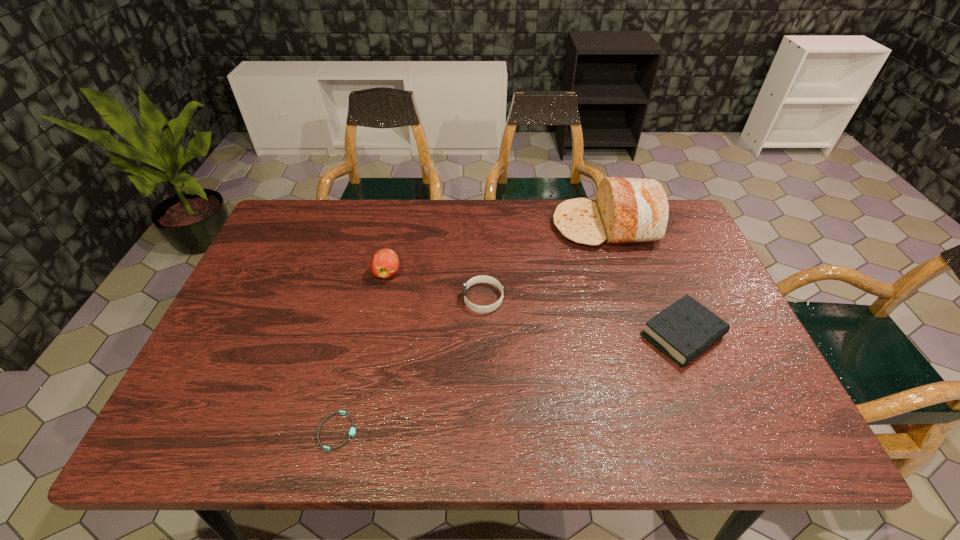
In order to click on Bible present at the right edge in this screenshot , I will do `click(685, 329)`.

What are the coordinates of `object that is at the far right corner` in the screenshot? It's located at (627, 210).

In the image, there is a desktop. Identify the location of vacant space at the far edge. The height and width of the screenshot is (540, 960). (512, 200).

You are a GUI agent. You are given a task and a screenshot of the screen. Output one action in this format:
    pyautogui.click(x=<x>, y=<y>)
    Task: Click on the vacant point at the near edge
    
    Given the screenshot: What is the action you would take?
    pyautogui.click(x=468, y=418)

In the image, there is a desktop. Where is `free space at the left edge`? free space at the left edge is located at coordinates (211, 349).

Image resolution: width=960 pixels, height=540 pixels. In the image, there is a desktop. What are the coordinates of `vacant space at the right edge` in the screenshot? It's located at (664, 278).

In the image, there is a desktop. Where is `blank space at the far left corner`? blank space at the far left corner is located at coordinates (312, 210).

Where is `free location at the near left corner`? The height and width of the screenshot is (540, 960). free location at the near left corner is located at coordinates (183, 444).

At what (x,y) coordinates should I click in order to perform the action: click on unoccupied area between the apple and the nearest object. Please return your answer as a coordinate pair (x, y). Looking at the image, I should click on (363, 352).

Where is `free area in between the third object from right to left and the bread`? This screenshot has height=540, width=960. free area in between the third object from right to left and the bread is located at coordinates (544, 262).